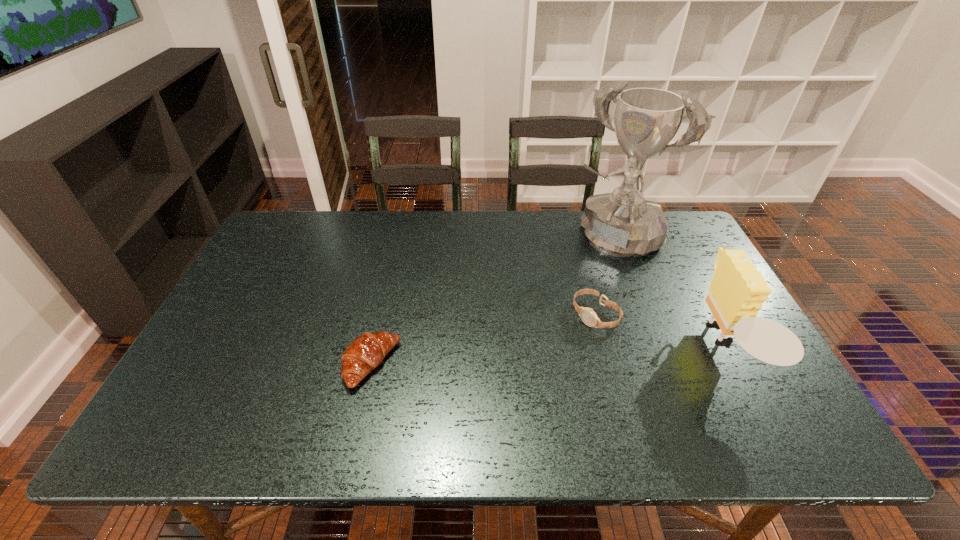
Locate an element on the screen. The height and width of the screenshot is (540, 960). the leftmost object is located at coordinates click(x=366, y=352).

The height and width of the screenshot is (540, 960). What are the coordinates of `sponge` in the screenshot? It's located at (736, 294).

The height and width of the screenshot is (540, 960). In order to click on award in this screenshot , I will do `click(623, 224)`.

Locate an element on the screen. This screenshot has height=540, width=960. the farthest object is located at coordinates (623, 224).

Where is `watch`? The height and width of the screenshot is (540, 960). watch is located at coordinates (588, 316).

Find the location of a particular element. The height and width of the screenshot is (540, 960). blank space located on the back of the leftmost object is located at coordinates (392, 274).

Where is `vacant space located on the side with emblem of the tallest object`? vacant space located on the side with emblem of the tallest object is located at coordinates (550, 301).

Where is `free point located 0.080m on the side with emblem of the tallest object`? The height and width of the screenshot is (540, 960). free point located 0.080m on the side with emblem of the tallest object is located at coordinates (577, 270).

Identify the location of free spot located 0.310m on the side with emblem of the tallest object. (538, 316).

Where is `vacant space situated 0.300m on the face of the watch`? Image resolution: width=960 pixels, height=540 pixels. vacant space situated 0.300m on the face of the watch is located at coordinates (495, 388).